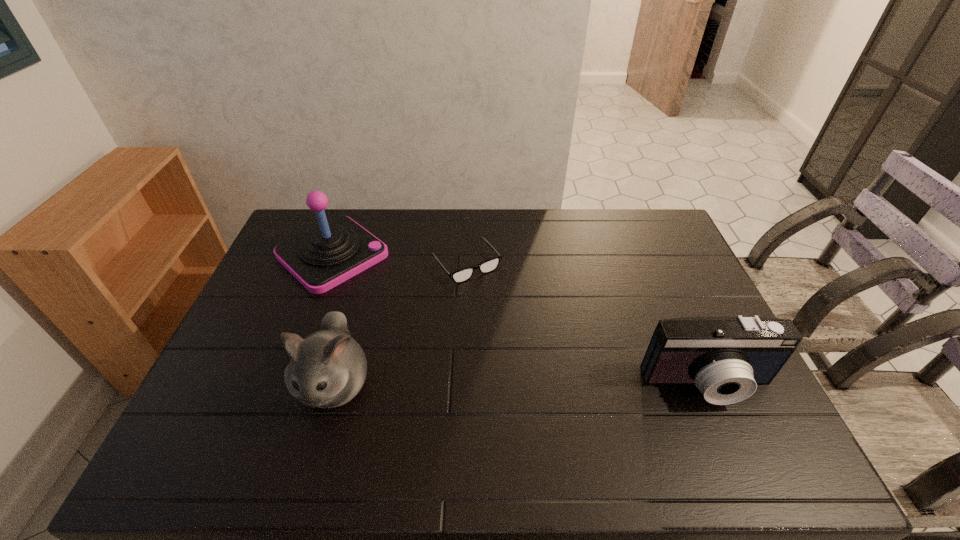
Locate an element on the screen. The height and width of the screenshot is (540, 960). vacant area between the joystick and the camcorder is located at coordinates (520, 320).

The width and height of the screenshot is (960, 540). I want to click on unoccupied position between the hamster and the rightmost object, so coord(521,384).

Find the location of a particular element. vacant area between the camcorder and the hamster is located at coordinates (521, 384).

Locate an element on the screen. object that is the second closest to the camcorder is located at coordinates (328, 368).

Identify which object is the closest to the joystick. Please provide its 2D coordinates. Your answer should be formatted as a tuple, i.e. [(x, y)], where the tuple contains the x and y coordinates of a point satisfying the conditions above.

[(462, 275)]

What are the coordinates of `free point that satisfies the following two spatial constraints: 1. on the front side of the shortest object; 2. on the right side of the joystick` in the screenshot? It's located at (329, 264).